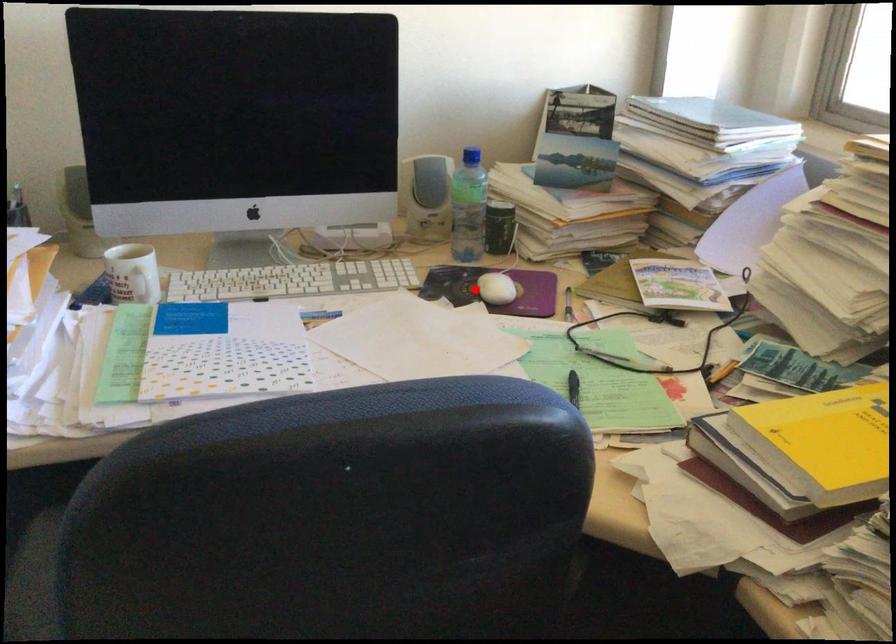
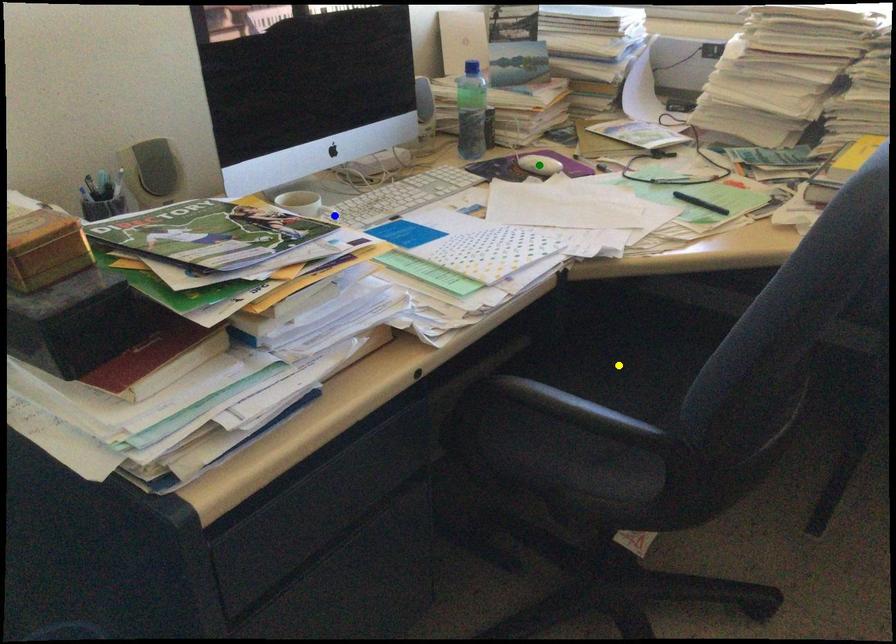
Question: I am providing you with two images of the same scene from different viewpoints. A red point is marked on the first image. You are given multiple points on the second image. Which point in image 2 is actually the same real-world point as the red point in image 1?

Choices:
 (A) green point
 (B) blue point
 (C) yellow point

Answer: (A)